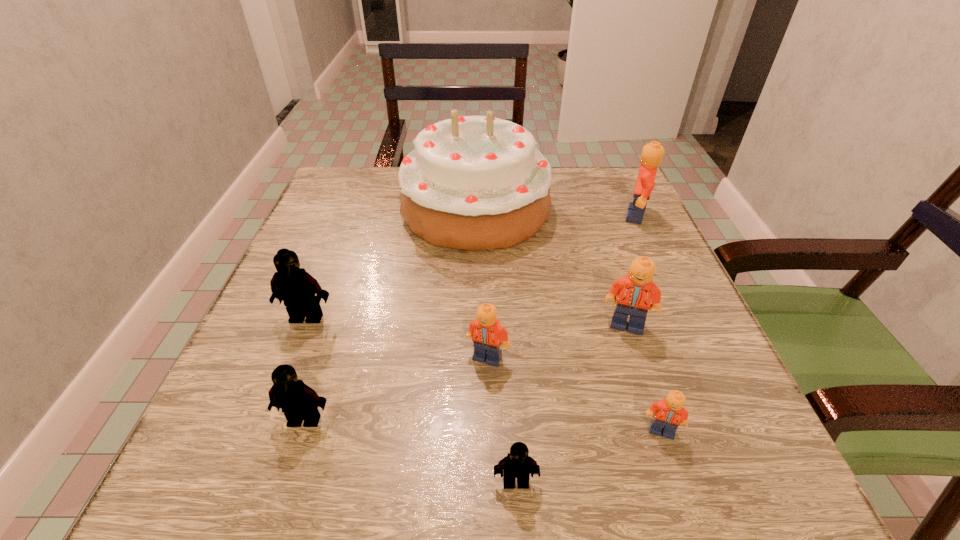
Find the location of `the tallest object`. the tallest object is located at coordinates (475, 183).

At what (x,y) coordinates should I click in order to perform the action: click on cake. Please return your answer as a coordinate pair (x, y). Looking at the image, I should click on (475, 183).

You are a GUI agent. You are given a task and a screenshot of the screen. Output one action in this format:
    pyautogui.click(x=<x>, y=<y>)
    Task: Click on the biggest orange Lego
    
    Given the screenshot: What is the action you would take?
    point(652,153)

Find the location of a particular element. The width and height of the screenshot is (960, 540). the rightmost orange Lego is located at coordinates (652, 153).

Identify the location of the second biggest orange Lego. (635, 292).

Locate an element on the screen. The height and width of the screenshot is (540, 960). the biggest black Lego is located at coordinates (291, 284).

In order to click on the third farthest orange Lego in this screenshot , I will do `click(486, 332)`.

The image size is (960, 540). I want to click on the fourth nearest Lego, so click(x=486, y=332).

This screenshot has width=960, height=540. What are the coordinates of `the second smallest black Lego` in the screenshot? It's located at (299, 402).

Find the location of a particular element. the smallest orange Lego is located at coordinates (669, 413).